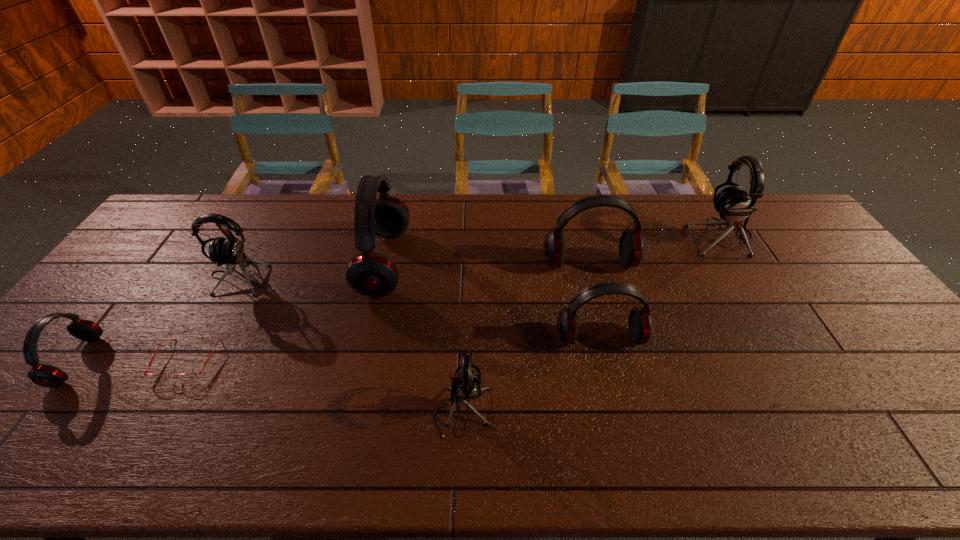
Point out which earphone is positioned as the third nearest to the spectacles. Please provide its 2D coordinates. Your answer should be formatted as a tuple, i.e. [(x, y)], where the tuple contains the x and y coordinates of a point satisfying the conditions above.

[(369, 273)]

At what (x,y) coordinates should I click in order to perform the action: click on black earphone identified as the second closest to the second biggest red earphone. Please return your answer as a coordinate pair (x, y). This screenshot has height=540, width=960. Looking at the image, I should click on (465, 387).

Point out which black earphone is positioned as the nearest to the second black earphone from right to left. Please provide its 2D coordinates. Your answer should be formatted as a tuple, i.e. [(x, y)], where the tuple contains the x and y coordinates of a point satisfying the conditions above.

[(230, 250)]

Find the location of a particular element. red earphone that stands as the second closest to the rightmost object is located at coordinates (640, 325).

Identify which red earphone is the third closest to the shortest object. Please provide its 2D coordinates. Your answer should be formatted as a tuple, i.e. [(x, y)], where the tuple contains the x and y coordinates of a point satisfying the conditions above.

[(640, 325)]

The height and width of the screenshot is (540, 960). Find the location of `blank area in the image that satisfies the following two spatial constraints: 1. on the ear cups of the fourth earphone from left to right; 2. on the left side of the third red earphone from right to left`. blank area in the image that satisfies the following two spatial constraints: 1. on the ear cups of the fourth earphone from left to right; 2. on the left side of the third red earphone from right to left is located at coordinates (349, 412).